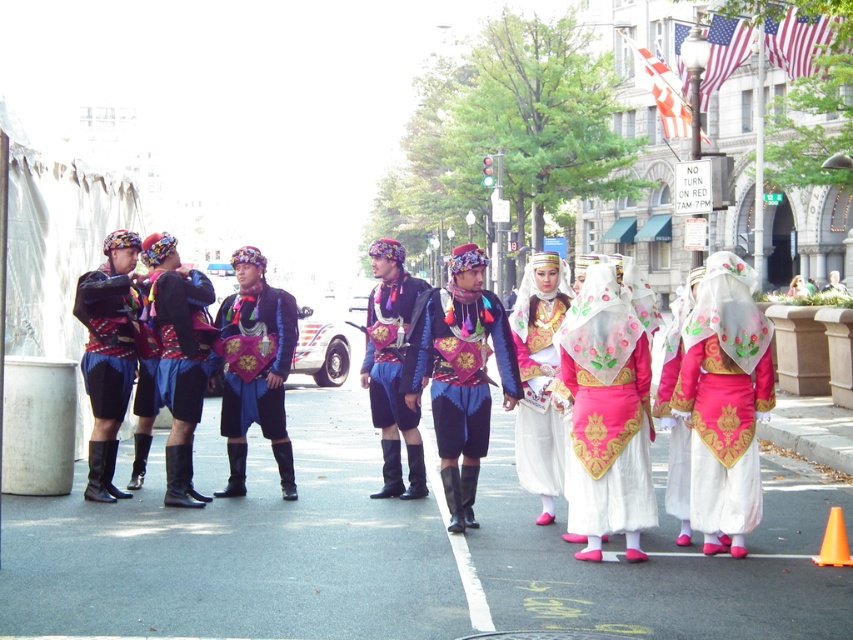
You are a photographer trying to capture both the white satin dress at center and the velvet blue skirt at center in a single shot. Since you want to emphasize the size difference between them, which one should you position closer to the camera to achieve this effect?

To emphasize the size difference between the white satin dress at center and the velvet blue skirt at center, you should position the white satin dress at center closer to the camera since it has a larger size compared to the velvet blue skirt at center.